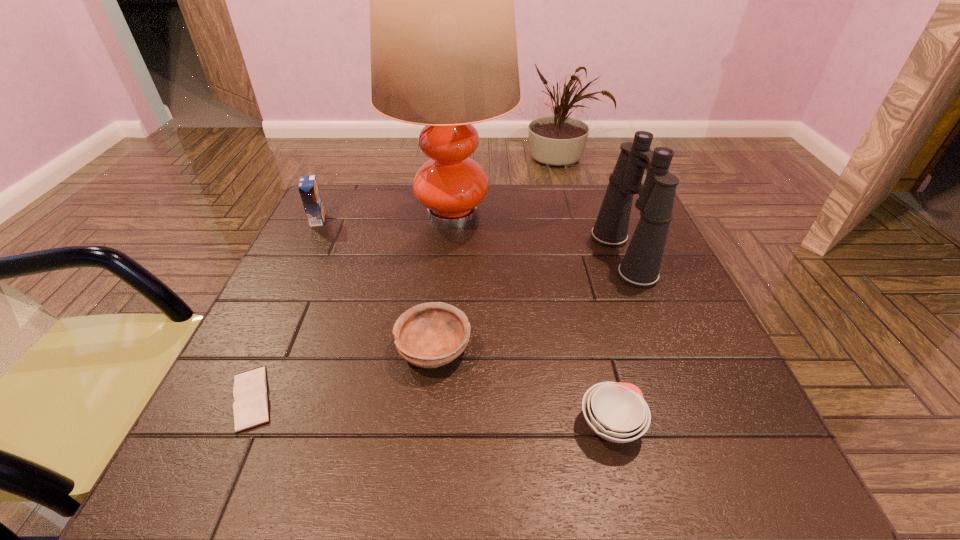
Image resolution: width=960 pixels, height=540 pixels. I want to click on free space that satisfies the following two spatial constraints: 1. on the back side of the diary; 2. on the right side of the tallest object, so click(x=335, y=215).

The width and height of the screenshot is (960, 540). Find the location of `vacant space that satisfies the following two spatial constraints: 1. on the front side of the orange_juice; 2. on the right side of the second object from right to left`. vacant space that satisfies the following two spatial constraints: 1. on the front side of the orange_juice; 2. on the right side of the second object from right to left is located at coordinates (216, 425).

The height and width of the screenshot is (540, 960). Identify the location of vacant point that satisfies the following two spatial constraints: 1. on the front side of the second object from right to left; 2. on the left side of the orange_juice. (216, 425).